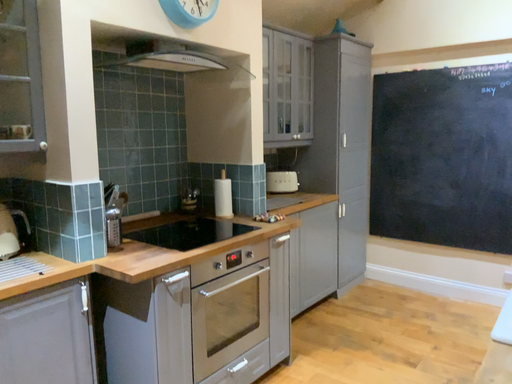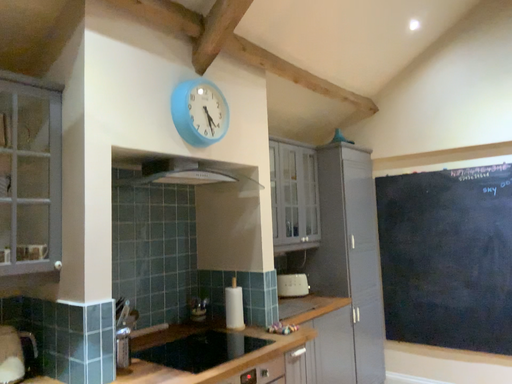
Question: How did the camera likely rotate when shooting the video?

Choices:
 (A) rotated upward
 (B) rotated downward

Answer: (A)